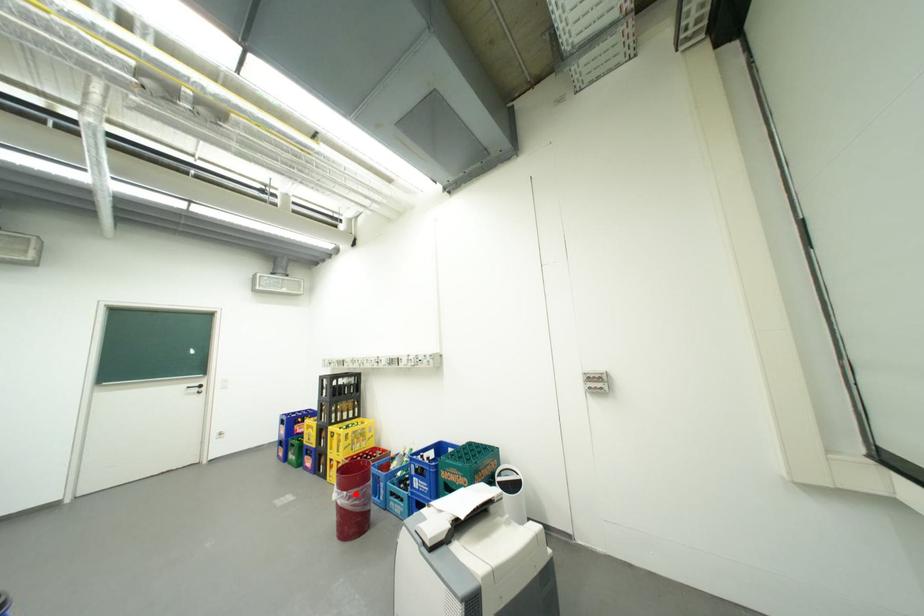
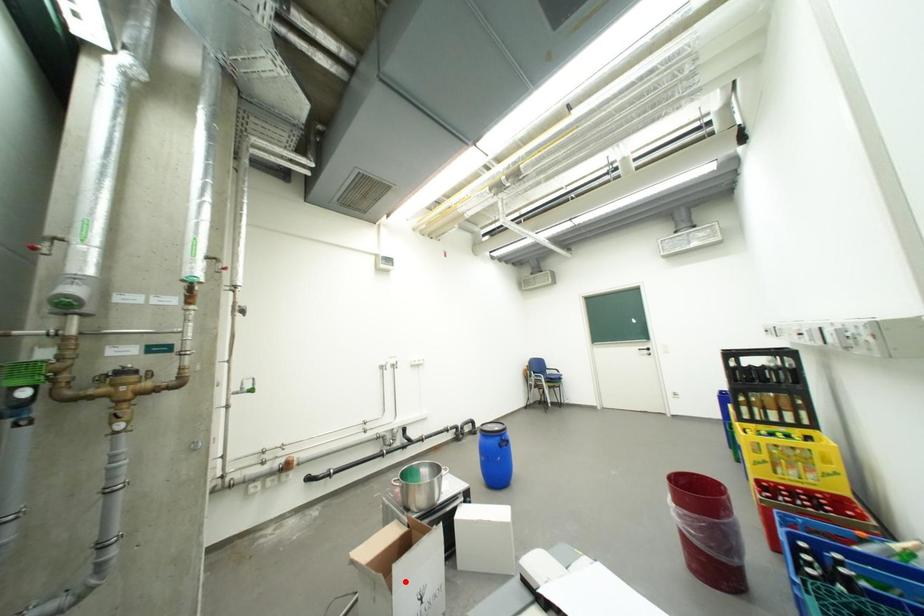
I am providing you with two images of the same scene from different viewpoints. A red point is marked on the first image and another point is marked on the second image. Are the points marked in image1 and image2 representing the same 3D position?

No